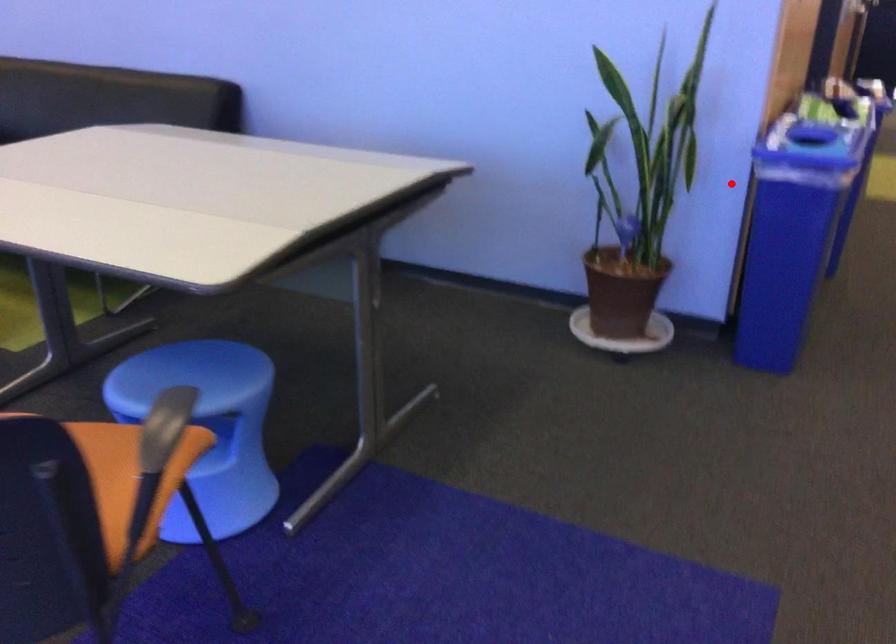
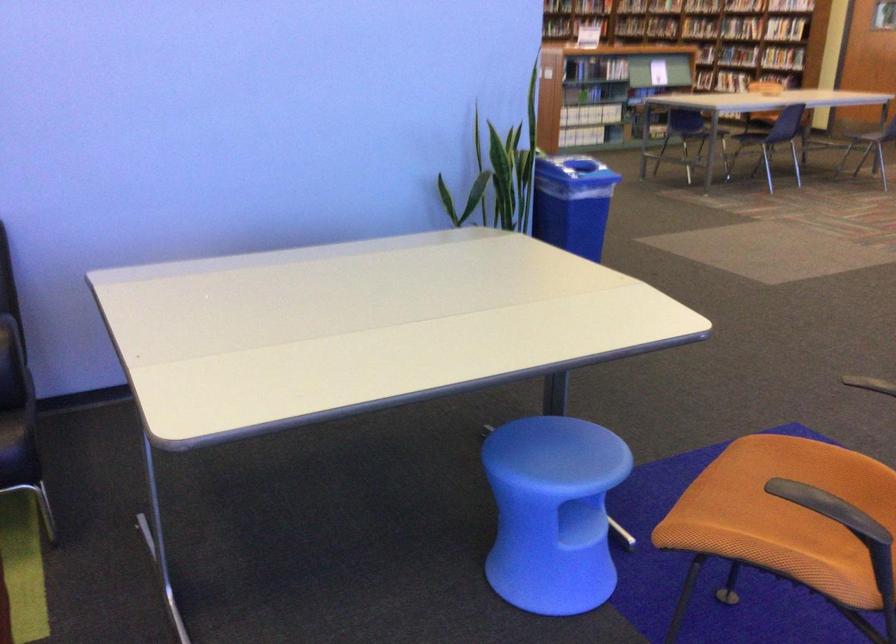
The point at the highlighted location is marked in the first image. Where is the corresponding point in the second image?

(572, 203)